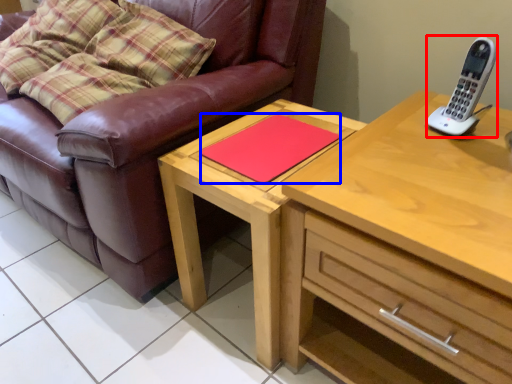
Question: Which object appears farthest to the camera in this image, gadget (highlighted by a red box) or pad (highlighted by a blue box)?

Choices:
 (A) gadget
 (B) pad

Answer: (B)